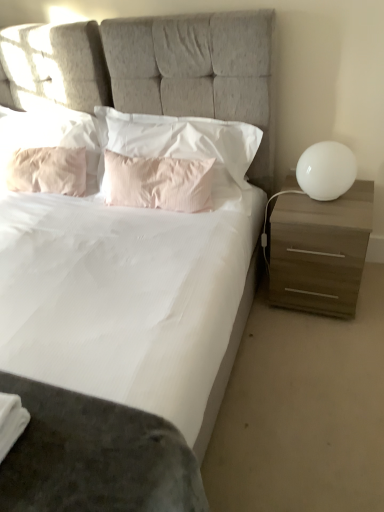
You are a GUI agent. You are given a task and a screenshot of the screen. Output one action in this format:
    pyautogui.click(x=<x>, y=<y>)
    Task: Click on the free region on the left part of white glossy sphere at right
    The height and width of the screenshot is (512, 384).
    Given the screenshot: What is the action you would take?
    pyautogui.click(x=289, y=203)